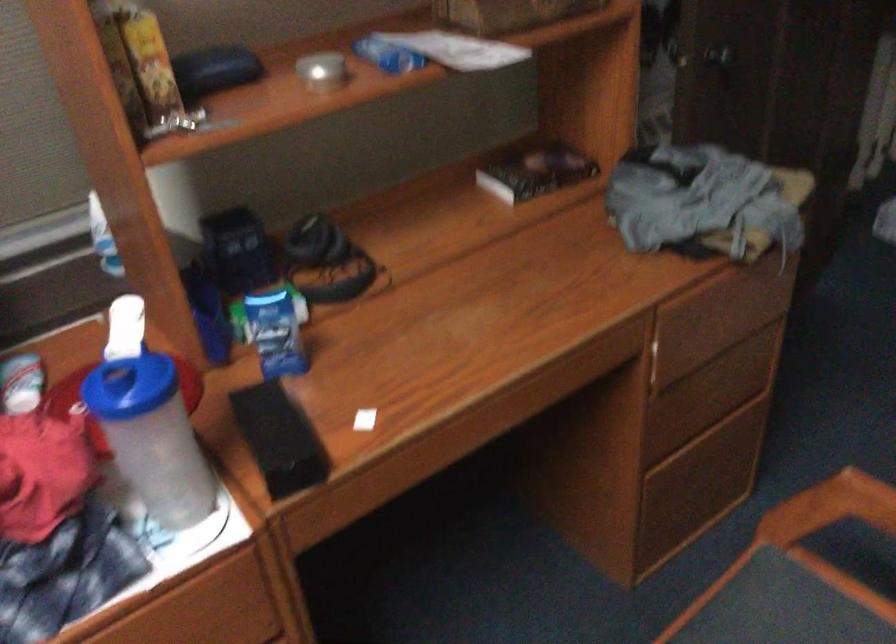
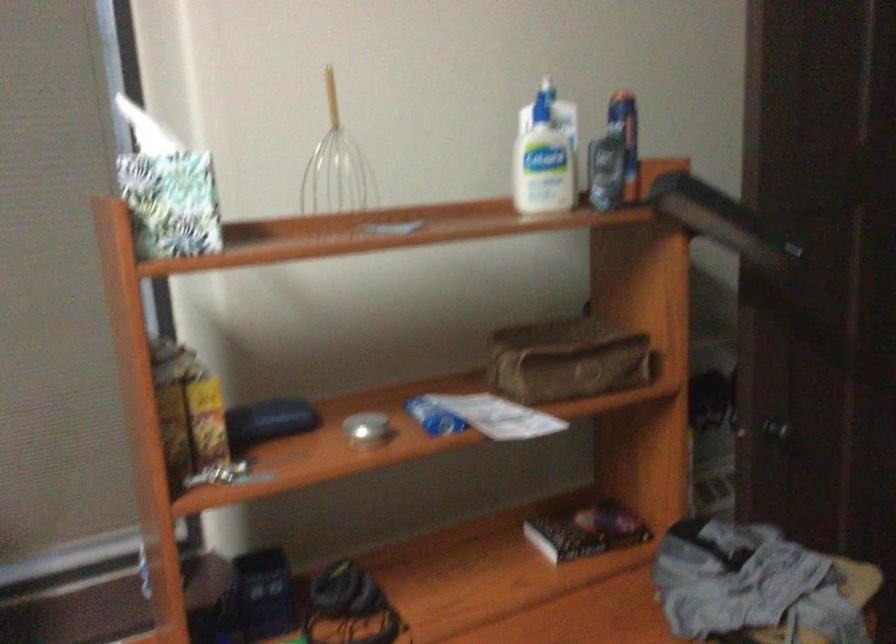
Question: The images are taken continuously from a first-person perspective. In which direction are you moving?

Choices:
 (A) Left
 (B) Right
 (C) Forward
 (D) Backward

Answer: (B)